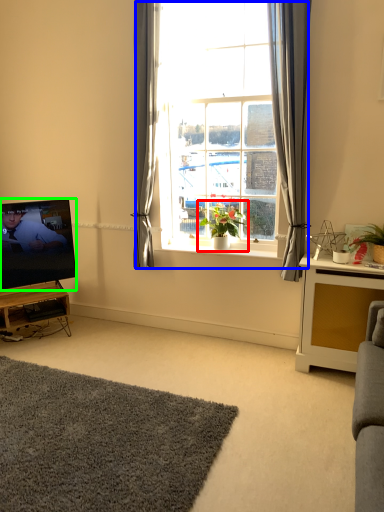
Question: Considering the real-world distances, which object is closest to houseplant (highlighted by a red box)? window (highlighted by a blue box) or television (highlighted by a green box).

Choices:
 (A) window
 (B) television

Answer: (A)